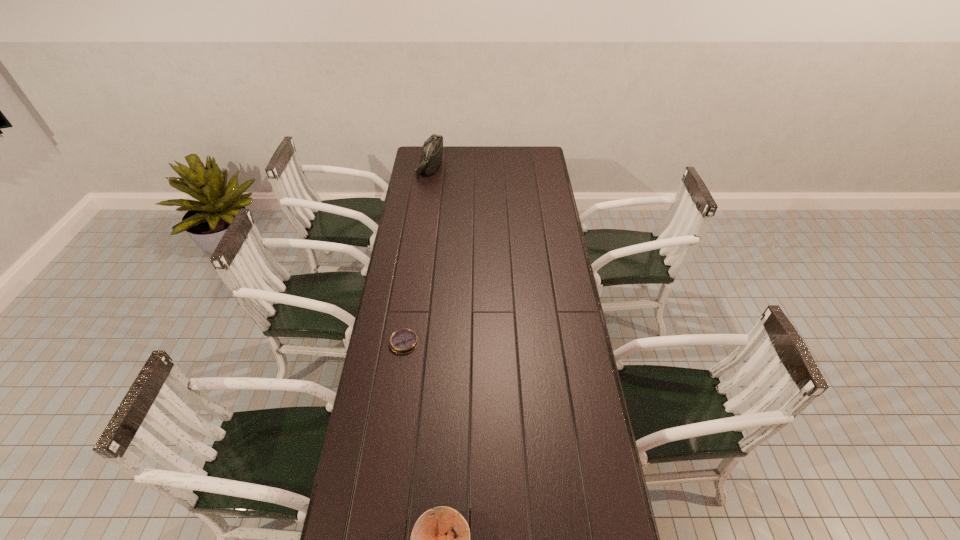
At what (x,y) coordinates should I click in order to perform the action: click on the farthest object. Please return your answer as a coordinate pair (x, y). Looking at the image, I should click on (432, 150).

Locate an element on the screen. shoulder bag is located at coordinates (432, 150).

You are a GUI agent. You are given a task and a screenshot of the screen. Output one action in this format:
    pyautogui.click(x=<x>, y=<y>)
    Task: Click on the compass
    This screenshot has height=540, width=960.
    Given the screenshot: What is the action you would take?
    pyautogui.click(x=403, y=341)

Locate an element on the screen. Image resolution: width=960 pixels, height=540 pixels. the shortest object is located at coordinates (403, 341).

Identify the location of free region located at the front padded panel of the shoulder bag. Image resolution: width=960 pixels, height=540 pixels. (512, 166).

What are the coordinates of `free spot located on the back of the shortest object` in the screenshot? It's located at (x=410, y=299).

At what (x,y) coordinates should I click in order to perform the action: click on object at the far edge. Please return your answer as a coordinate pair (x, y). This screenshot has height=540, width=960. Looking at the image, I should click on (432, 150).

This screenshot has height=540, width=960. Identify the location of shoulder bag located at the left edge. (432, 150).

Where is `compass that is positioned at the left edge`? The width and height of the screenshot is (960, 540). compass that is positioned at the left edge is located at coordinates (403, 341).

What are the coordinates of `object that is positioned at the far left corner` in the screenshot? It's located at (432, 150).